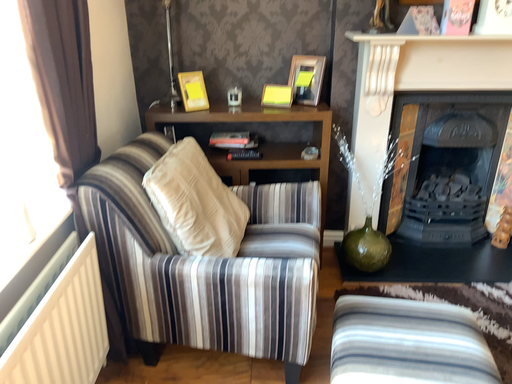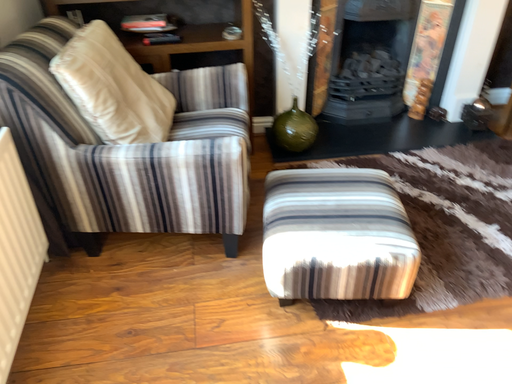
Question: Which way did the camera rotate in the video?

Choices:
 (A) rotated downward
 (B) rotated upward

Answer: (A)